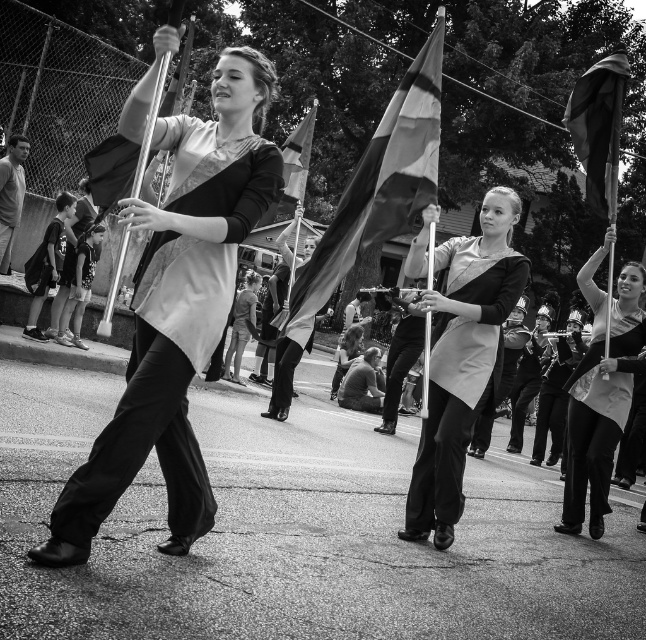
You are standing in the crowd watching the marching band. You notice two points in the image. The first point is at coordinates point (599, 193) and the second point is at coordinates point (282, 326). Which point do you see closer to you?

Point (599, 193) is closer to the camera than point (282, 326), so you see point (599, 193) closer to you.

You are a photographer standing in the crowd watching the marching band. You want to take a photo of the matte black flag at left. Where should you aim your camera to capture it perfectly?

The matte black flag at left is located at the 2D coordinates point 0.484 on the x axis and 0.276 on the y axis, so aim your camera at that point to capture it perfectly.